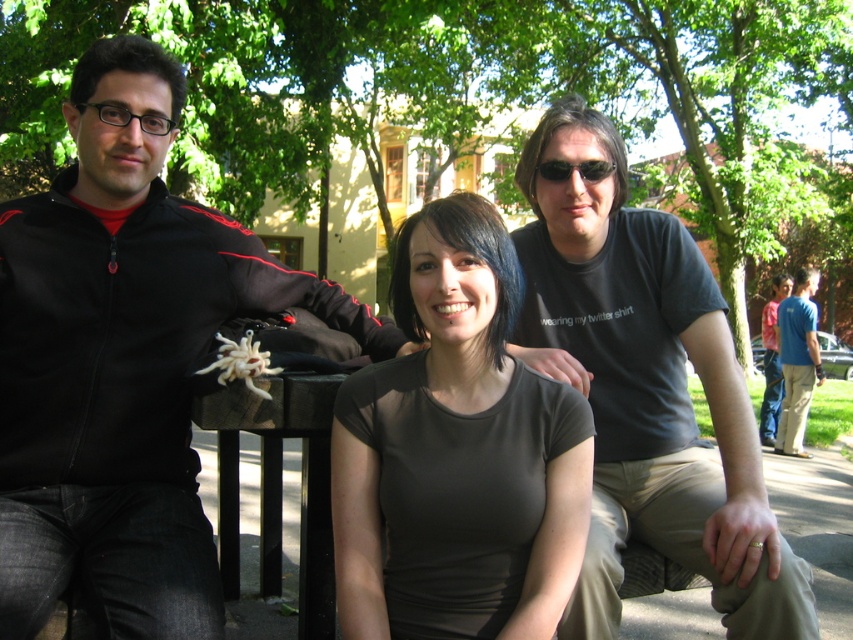
Question: Which point appears closest to the camera in this image?

Choices:
 (A) (433, 516)
 (B) (173, 509)
 (C) (786, 330)
 (D) (573, 168)

Answer: (A)

Question: Which point is farther from the camera taking this photo?

Choices:
 (A) 527,572
 (B) 726,474

Answer: (B)

Question: Is dark gray t-shirt at center closer to the viewer compared to matte gray shirt at center?

Choices:
 (A) no
 (B) yes

Answer: (A)

Question: Estimate the real-world distances between objects in this image. Which object is closer to the matte gray shirt at center?

Choices:
 (A) blue cotton shirt at lower right
 (B) sunglasses at center

Answer: (B)

Question: Is dark gray t-shirt at center below sunglasses at center?

Choices:
 (A) yes
 (B) no

Answer: (A)

Question: In this image, where is blue cotton shirt at lower right located relative to sunglasses at center?

Choices:
 (A) above
 (B) below

Answer: (A)